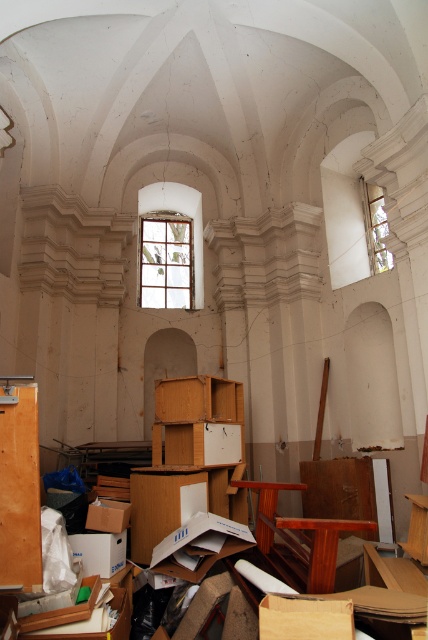
Question: Does clear glass window at center have a smaller size compared to clear glass window at upper right?

Choices:
 (A) yes
 (B) no

Answer: (B)

Question: Does clear glass window at center lie in front of clear glass window at upper right?

Choices:
 (A) no
 (B) yes

Answer: (A)

Question: Which of the following is the farthest from the observer?

Choices:
 (A) (380, 204)
 (B) (172, 232)

Answer: (B)

Question: Which object is farther from the camera taking this photo?

Choices:
 (A) clear glass window at upper right
 (B) clear glass window at center

Answer: (B)

Question: Can you confirm if clear glass window at center is positioned to the right of clear glass window at upper right?

Choices:
 (A) no
 (B) yes

Answer: (A)